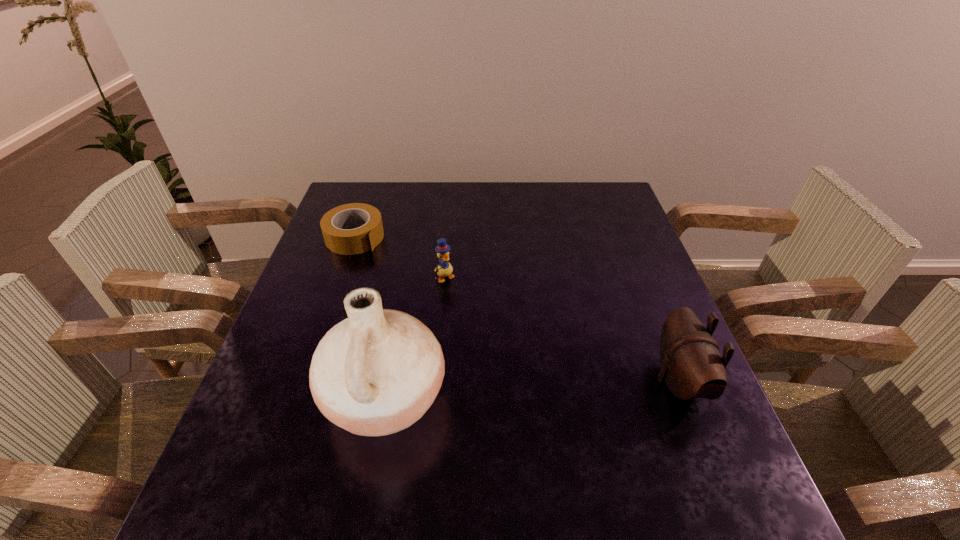
Where is `free space at the left edge of the desktop`? This screenshot has width=960, height=540. free space at the left edge of the desktop is located at coordinates (337, 287).

The image size is (960, 540). I want to click on free location at the right edge of the desktop, so click(x=643, y=335).

You are a GUI agent. You are given a task and a screenshot of the screen. Output one action in this format:
    pyautogui.click(x=<x>, y=<y>)
    Task: Click on the vacant space at the near left corner of the desktop
    
    Given the screenshot: What is the action you would take?
    [249, 460]

Find the location of a particular element. vacant region between the pottery and the second tallest object is located at coordinates (532, 389).

Image resolution: width=960 pixels, height=540 pixels. I want to click on free space between the duct tape and the second tallest object, so click(x=516, y=309).

This screenshot has height=540, width=960. What are the coordinates of `vacant region between the pouch and the shortest object` in the screenshot? It's located at (516, 309).

The width and height of the screenshot is (960, 540). What are the coordinates of `blank region between the rightmost object and the duckling` in the screenshot? It's located at point(562,329).

You are a GUI agent. You are given a task and a screenshot of the screen. Output one action in this format:
    pyautogui.click(x=<x>, y=<y>)
    Task: Click on the vacant region between the duct tape and the rightmost object
    Image resolution: width=960 pixels, height=540 pixels.
    Given the screenshot: What is the action you would take?
    pyautogui.click(x=516, y=309)

Locate an element on the screen. free spot between the third shortest object and the tallest object is located at coordinates (532, 389).

I want to click on blank region between the third shortest object and the duckling, so click(x=562, y=329).